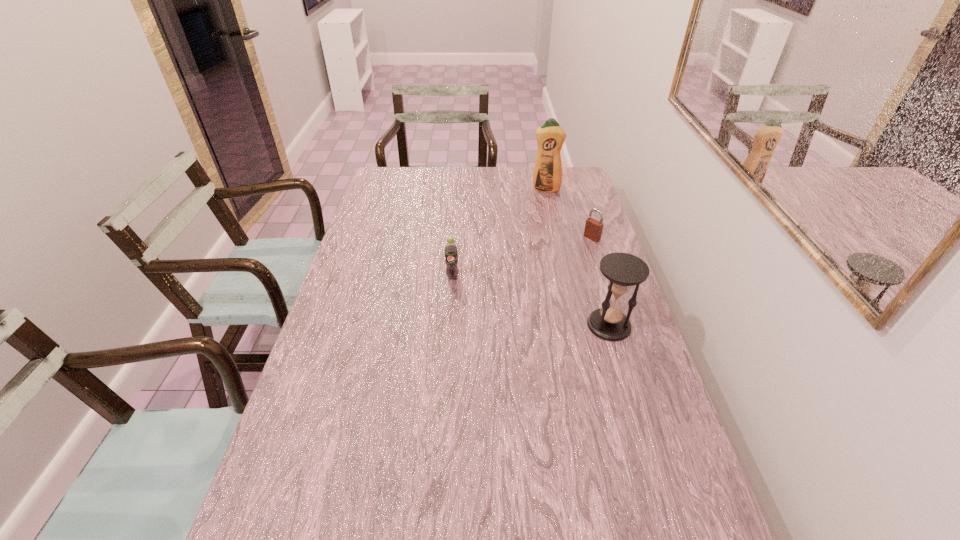
In order to click on object that can be found as the closest to the padlock in this screenshot , I will do `click(547, 177)`.

The width and height of the screenshot is (960, 540). Identify the location of vacant space that satisfies the following two spatial constraints: 1. on the front label of the third farthest object; 2. on the left side of the third shortest object. (449, 325).

Identify the location of blank space that satisfies the following two spatial constraints: 1. on the front label of the hourglass; 2. on the right side of the soda. The width and height of the screenshot is (960, 540). (449, 325).

Locate an element on the screen. free spot that satisfies the following two spatial constraints: 1. on the front label of the soda; 2. on the right side of the hourglass is located at coordinates (449, 325).

Where is `free spot that satisfies the following two spatial constraints: 1. on the front label of the nearest object; 2. on the left side of the soda`? This screenshot has width=960, height=540. free spot that satisfies the following two spatial constraints: 1. on the front label of the nearest object; 2. on the left side of the soda is located at coordinates (449, 325).